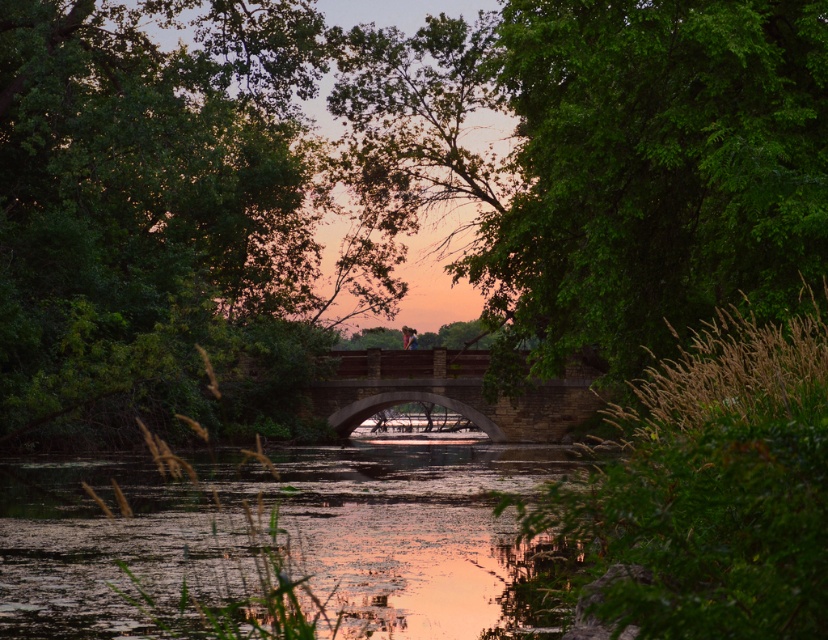
Who is shorter, translucent green water at lower center or brown stone bridge at center?

Standing shorter between the two is translucent green water at lower center.

Between translucent green water at lower center and brown stone bridge at center, which one has more height?

Standing taller between the two is brown stone bridge at center.

What do you see at coordinates (283, 536) in the screenshot? The width and height of the screenshot is (828, 640). I see `translucent green water at lower center` at bounding box center [283, 536].

Find the location of a particular element. translucent green water at lower center is located at coordinates click(283, 536).

Does green leafy tree at center appear over brown stone bridge at center?

Correct, green leafy tree at center is located above brown stone bridge at center.

Does green leafy tree at center appear under brown stone bridge at center?

Actually, green leafy tree at center is above brown stone bridge at center.

Image resolution: width=828 pixels, height=640 pixels. I want to click on green leafy tree at center, so click(388, 184).

Is point (148, 161) farther from viewer compared to point (503, 588)?

Yes, it is behind point (503, 588).

Find the location of a particular element. The image size is (828, 640). green leafy tree at center is located at coordinates (388, 184).